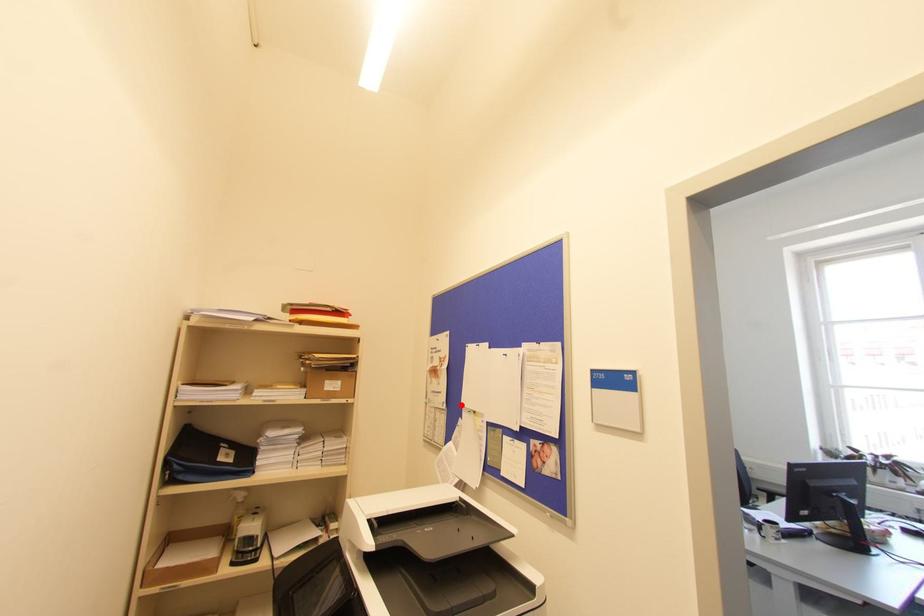
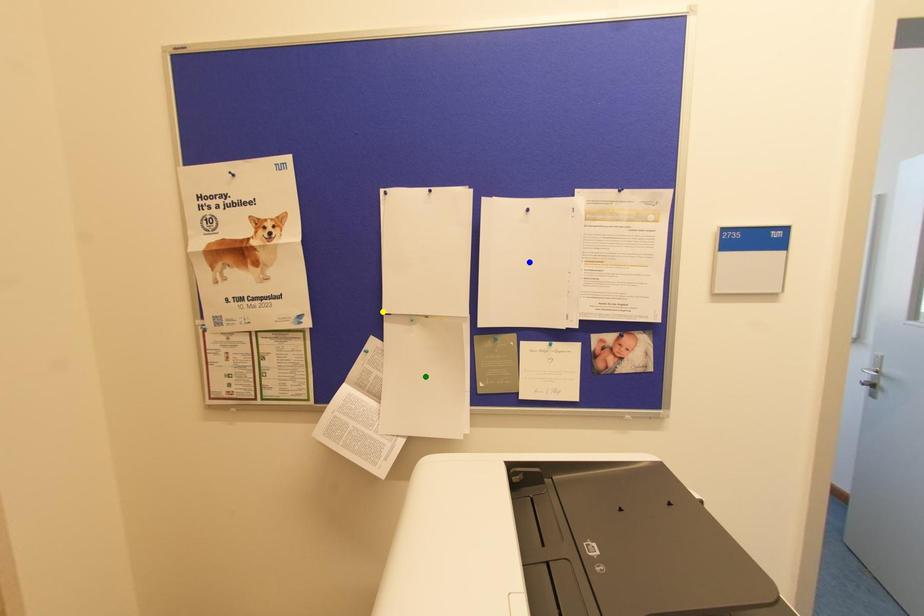
Question: I am providing you with two images of the same scene from different viewpoints. A red point is marked on the first image. You are given multiple points on the second image. Which mark in image 2 goes with the point in image 1?

Choices:
 (A) yellow point
 (B) green point
 (C) blue point

Answer: (A)